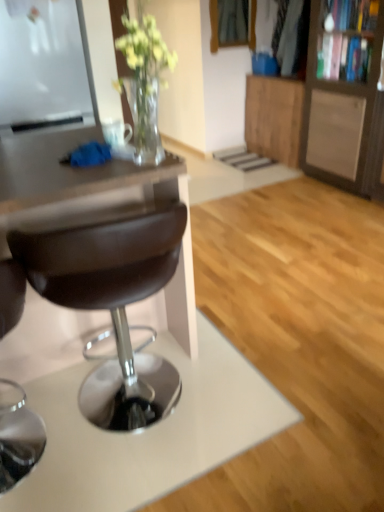
You are a GUI agent. You are given a task and a screenshot of the screen. Output one action in this format:
    pyautogui.click(x=<x>, y=<y>)
    Task: Click on the free location to the right of brown leather stool at center
    The height and width of the screenshot is (512, 384).
    Given the screenshot: What is the action you would take?
    pyautogui.click(x=258, y=413)